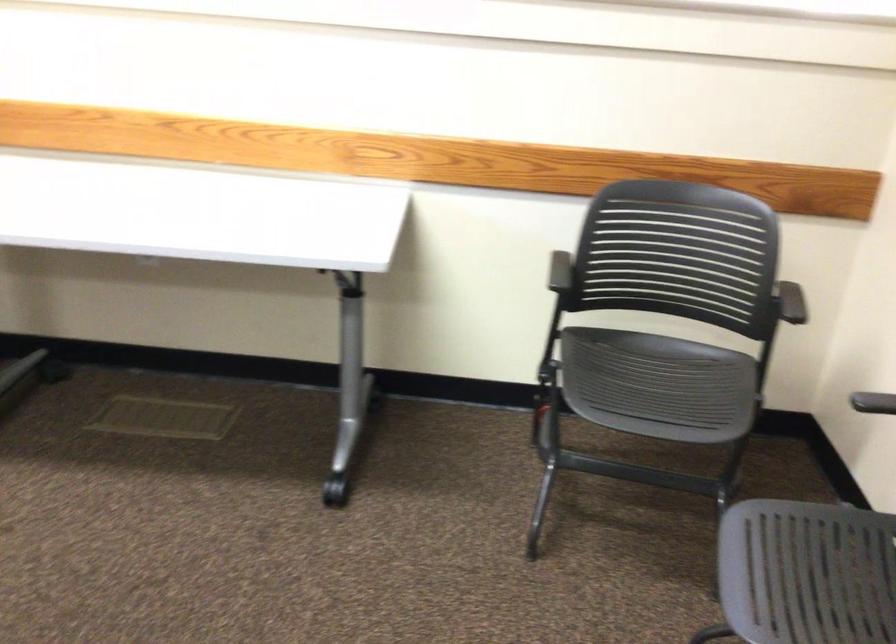
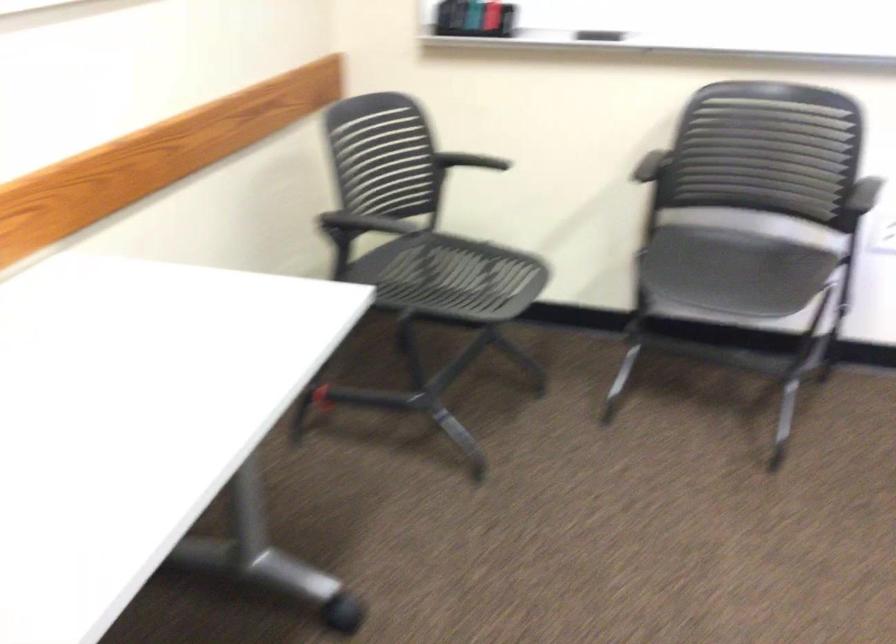
Where in the second image is the point corresponding to pixel 673 391 from the first image?

(451, 277)